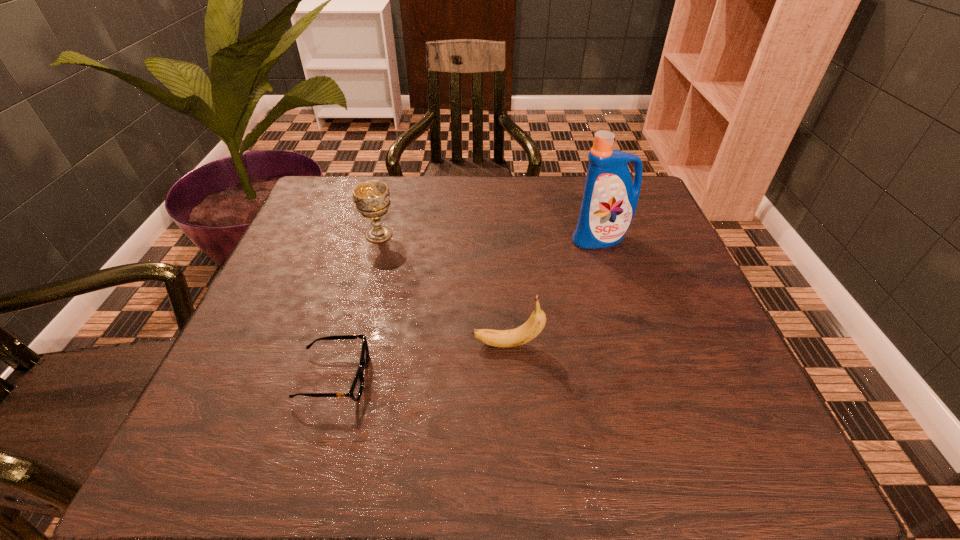
Where is `the tallest object`? The height and width of the screenshot is (540, 960). the tallest object is located at coordinates (610, 199).

The height and width of the screenshot is (540, 960). Identify the location of the rightmost object. (610, 199).

Where is `chalice`? chalice is located at coordinates (371, 198).

You are a GUI agent. You are given a task and a screenshot of the screen. Output one action in this format:
    pyautogui.click(x=<x>, y=<y>)
    Task: Click on the banana
    
    Given the screenshot: What is the action you would take?
    pyautogui.click(x=534, y=325)

In order to click on sunglasses in this screenshot , I will do `click(357, 386)`.

Locate an element on the screen. free space located 0.300m on the label of the rightmost object is located at coordinates pos(636,352).

Locate an element on the screen. Image resolution: width=960 pixels, height=540 pixels. vacant region located 0.140m on the back of the chalice is located at coordinates (390, 194).

Locate an element on the screen. The height and width of the screenshot is (540, 960). free space located 0.080m at the start of the peel on the banana is located at coordinates (431, 345).

Where is `vacant space located 0.050m at the start of the peel on the banana`? This screenshot has width=960, height=540. vacant space located 0.050m at the start of the peel on the banana is located at coordinates (446, 345).

What are the coordinates of `vacant position located at the start of the peel on the banana` in the screenshot? It's located at (383, 345).